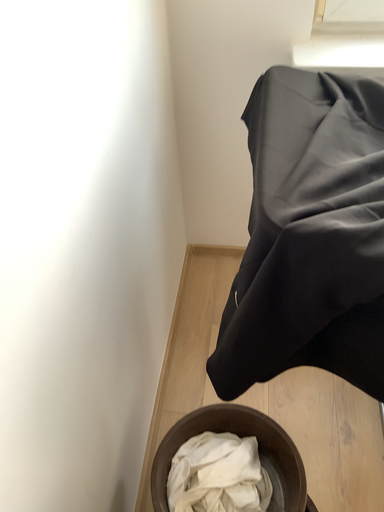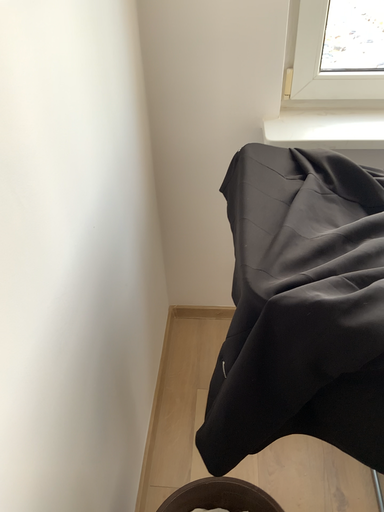
Question: How did the camera likely rotate when shooting the video?

Choices:
 (A) rotated downward
 (B) rotated upward

Answer: (B)